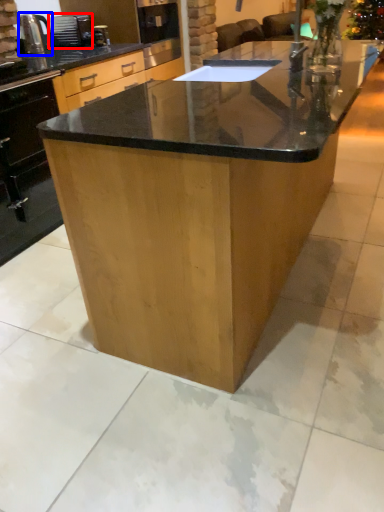
Question: Among these objects, which one is farthest to the camera, appliance (highlighted by a red box) or kitchen appliance (highlighted by a blue box)?

Choices:
 (A) appliance
 (B) kitchen appliance

Answer: (A)